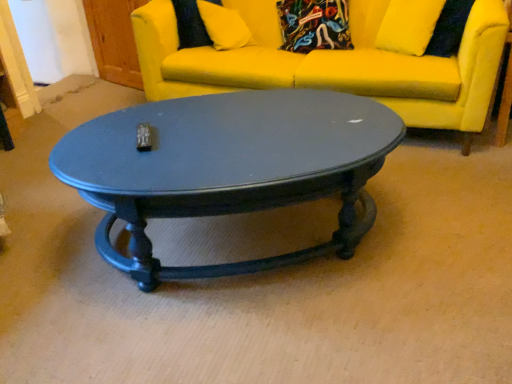
Question: Is there a large distance between matte black coffee table at center and yellow fabric pillow at upper center?

Choices:
 (A) yes
 (B) no

Answer: (A)

Question: Is matte black coffee table at center to the right of yellow fabric pillow at upper center from the viewer's perspective?

Choices:
 (A) no
 (B) yes

Answer: (B)

Question: Is matte black coffee table at center shorter than yellow fabric pillow at upper center?

Choices:
 (A) yes
 (B) no

Answer: (B)

Question: Is matte black coffee table at center outside yellow fabric pillow at upper center?

Choices:
 (A) yes
 (B) no

Answer: (A)

Question: From the image's perspective, would you say matte black coffee table at center is shown under yellow fabric pillow at upper center?

Choices:
 (A) yes
 (B) no

Answer: (A)

Question: Is matte black coffee table at center situated inside yellow fabric pillow at upper center or outside?

Choices:
 (A) inside
 (B) outside

Answer: (B)

Question: Is point (238, 274) positioned closer to the camera than point (202, 11)?

Choices:
 (A) farther
 (B) closer

Answer: (B)

Question: Based on their sizes in the image, would you say matte black coffee table at center is bigger or smaller than yellow fabric pillow at upper center?

Choices:
 (A) big
 (B) small

Answer: (A)

Question: Relative to yellow fabric pillow at upper center, is matte black coffee table at center in front or behind?

Choices:
 (A) behind
 (B) front

Answer: (B)

Question: Relative to yellow fabric couch at upper center, is matte black coffee table at center in front or behind?

Choices:
 (A) front
 (B) behind

Answer: (A)

Question: Is matte black coffee table at center taller or shorter than yellow fabric couch at upper center?

Choices:
 (A) short
 (B) tall

Answer: (A)

Question: From the image's perspective, is matte black coffee table at center positioned above or below yellow fabric couch at upper center?

Choices:
 (A) above
 (B) below

Answer: (B)

Question: From a real-world perspective, relative to yellow fabric couch at upper center, is matte black coffee table at center vertically above or below?

Choices:
 (A) above
 (B) below

Answer: (B)

Question: Is point (217, 34) positioned closer to the camera than point (455, 107)?

Choices:
 (A) closer
 (B) farther

Answer: (B)

Question: Is yellow fabric pillow at upper center wider or thinner than yellow fabric couch at upper center?

Choices:
 (A) wide
 (B) thin

Answer: (B)